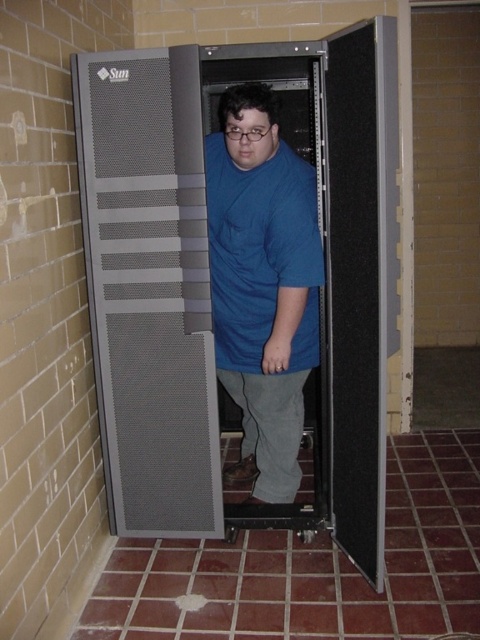
You are a technician standing at the entrance of the server room. You need to access the gray perforated metal server rack at center. Based on the coordinates provided, which direction should you move to reach it?

The gray perforated metal server rack at center is located at coordinates point (208, 278), so you should move towards the center of the server room to reach it.

You are a technician who needs to access the top of the gray perforated metal server rack at center to install a component. Given your height and the height of the blue cotton shirt at center, can you reach the top without a ladder?

The gray perforated metal server rack at center is taller than the blue cotton shirt at center. Since the blue cotton shirt at center represents your height, you would need a ladder to reach the top of the server rack.